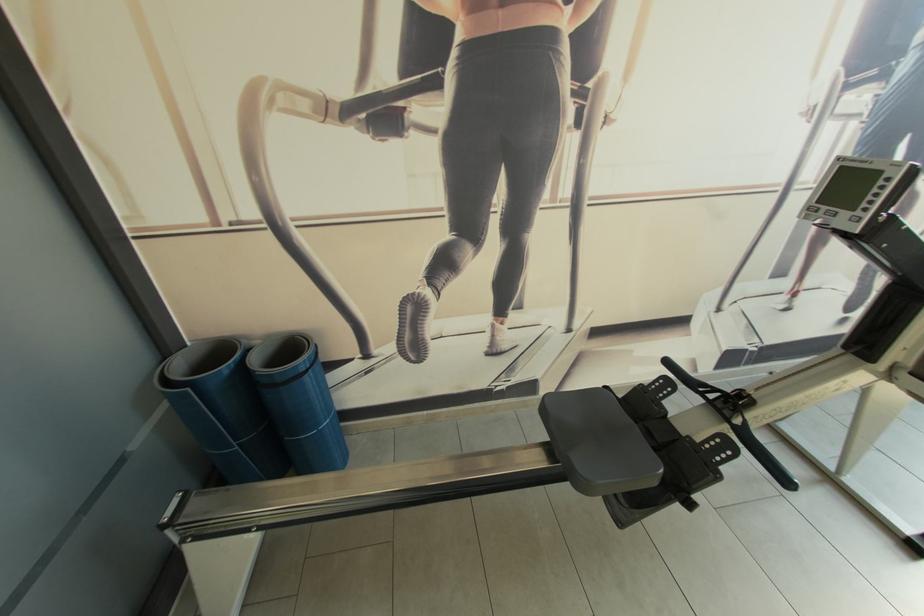
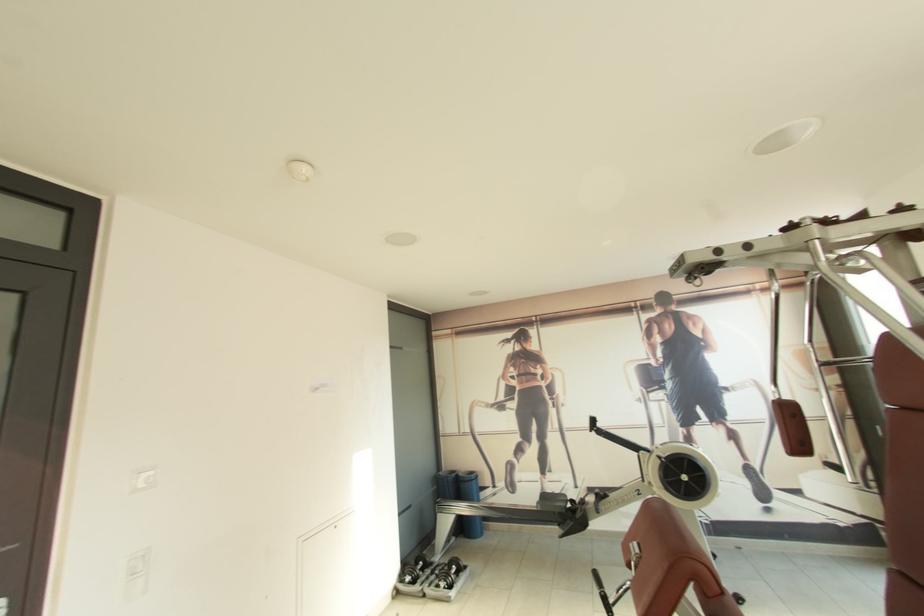
Where in the second image is the point corresponding to (274,235) from the first image?

(476, 438)